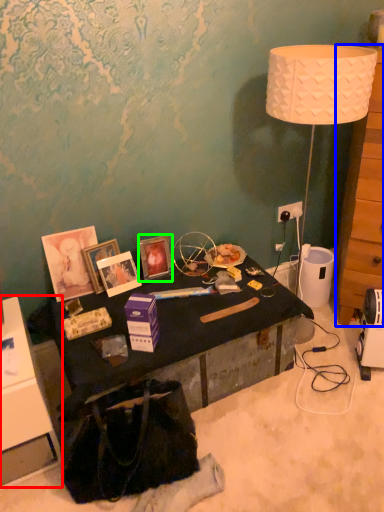
Question: Which object is the closest to the cabinetry (highlighted by a red box)? Choose among these: dresser (highlighted by a blue box) or picture frame (highlighted by a green box).

Choices:
 (A) dresser
 (B) picture frame

Answer: (B)